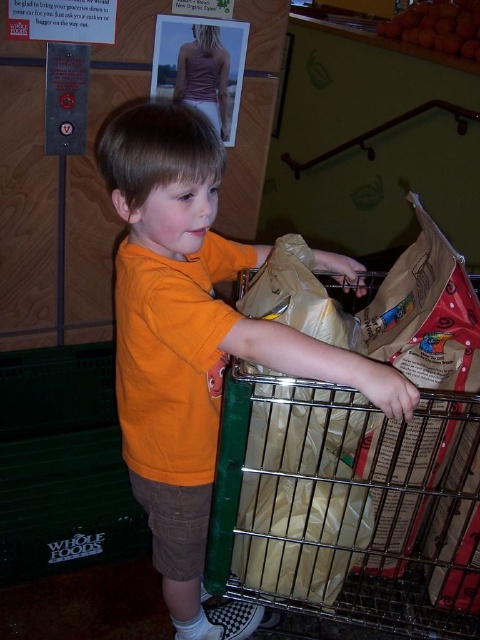
Between orange cotton shirt at center and metallic silver shopping cart at center, which one appears on the right side from the viewer's perspective?

Positioned to the right is metallic silver shopping cart at center.

The height and width of the screenshot is (640, 480). What do you see at coordinates (192, 342) in the screenshot? I see `orange cotton shirt at center` at bounding box center [192, 342].

Image resolution: width=480 pixels, height=640 pixels. Find the location of `orange cotton shirt at center`. orange cotton shirt at center is located at coordinates (192, 342).